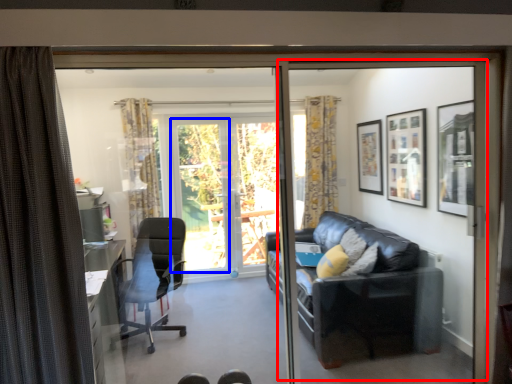
Question: Which point is closer to the camera, screen door (highlighted by a red box) or window screen (highlighted by a blue box)?

Choices:
 (A) screen door
 (B) window screen

Answer: (A)